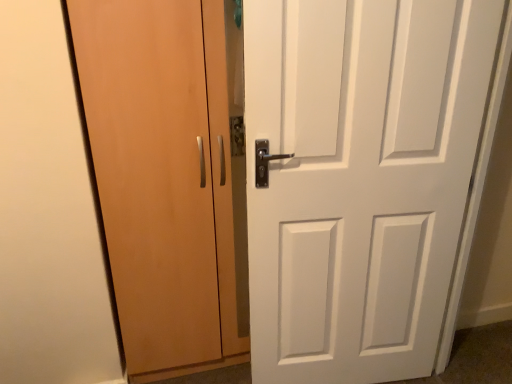
I want to click on matte wood cabinet at left, marked as the 1th door in a left-to-right arrangement, so click(162, 177).

Image resolution: width=512 pixels, height=384 pixels. What do you see at coordinates (162, 177) in the screenshot? I see `matte wood cabinet at left, marked as the 1th door in a left-to-right arrangement` at bounding box center [162, 177].

This screenshot has width=512, height=384. Find the location of `white matte door at center, which is counted as the first door, starting from the right`. white matte door at center, which is counted as the first door, starting from the right is located at coordinates (358, 178).

This screenshot has height=384, width=512. What do you see at coordinates (358, 178) in the screenshot? I see `white matte door at center, the 2th door when ordered from left to right` at bounding box center [358, 178].

The height and width of the screenshot is (384, 512). I want to click on matte wood cabinet at left, marked as the 1th door in a left-to-right arrangement, so click(162, 177).

Can you confirm if matte wood cabinet at left, marked as the 2th door in a right-to-left arrangement, is positioned to the right of white matte door at center, the 2th door when ordered from left to right?

No, matte wood cabinet at left, marked as the 2th door in a right-to-left arrangement, is not to the right of white matte door at center, the 2th door when ordered from left to right.

Based on the photo, is the depth of matte wood cabinet at left, marked as the 2th door in a right-to-left arrangement, greater than that of white matte door at center, the 2th door when ordered from left to right?

Yes, matte wood cabinet at left, marked as the 2th door in a right-to-left arrangement, is behind white matte door at center, the 2th door when ordered from left to right.

Considering the points (217, 75) and (253, 54), which point is behind, point (217, 75) or point (253, 54)?

Positioned behind is point (217, 75).

From the image's perspective, which is above, matte wood cabinet at left, marked as the 1th door in a left-to-right arrangement, or white matte door at center, the 2th door when ordered from left to right?

matte wood cabinet at left, marked as the 1th door in a left-to-right arrangement, appears higher in the image.

From the picture: From a real-world perspective, is matte wood cabinet at left, marked as the 1th door in a left-to-right arrangement, positioned above or below white matte door at center, the 2th door when ordered from left to right?

Clearly, from a real-world perspective, matte wood cabinet at left, marked as the 1th door in a left-to-right arrangement, is above white matte door at center, the 2th door when ordered from left to right.

Looking at their sizes, would you say matte wood cabinet at left, marked as the 1th door in a left-to-right arrangement, is wider or thinner than white matte door at center, which is counted as the first door, starting from the right?

Clearly, matte wood cabinet at left, marked as the 1th door in a left-to-right arrangement, has more width compared to white matte door at center, which is counted as the first door, starting from the right.

From the picture: Between matte wood cabinet at left, marked as the 2th door in a right-to-left arrangement, and white matte door at center, the 2th door when ordered from left to right, which one has more height?

matte wood cabinet at left, marked as the 2th door in a right-to-left arrangement.

Looking at the image, does matte wood cabinet at left, marked as the 2th door in a right-to-left arrangement, seem bigger or smaller compared to white matte door at center, which is counted as the first door, starting from the right?

matte wood cabinet at left, marked as the 2th door in a right-to-left arrangement, is bigger than white matte door at center, which is counted as the first door, starting from the right.

Is white matte door at center, the 2th door when ordered from left to right, located within matte wood cabinet at left, marked as the 1th door in a left-to-right arrangement?

No, white matte door at center, the 2th door when ordered from left to right, is not a part of matte wood cabinet at left, marked as the 1th door in a left-to-right arrangement.

Would you consider matte wood cabinet at left, marked as the 2th door in a right-to-left arrangement, to be distant from white matte door at center, which is counted as the first door, starting from the right?

They are positioned close to each other.

Is matte wood cabinet at left, marked as the 1th door in a left-to-right arrangement, positioned with its back to white matte door at center, the 2th door when ordered from left to right?

That's not correct — matte wood cabinet at left, marked as the 1th door in a left-to-right arrangement, is not looking away from white matte door at center, the 2th door when ordered from left to right.

This screenshot has width=512, height=384. I want to click on door on the left of white matte door at center, which is counted as the first door, starting from the right, so click(x=162, y=177).

Which is more to the left, white matte door at center, the 2th door when ordered from left to right, or matte wood cabinet at left, marked as the 1th door in a left-to-right arrangement?

matte wood cabinet at left, marked as the 1th door in a left-to-right arrangement.

Is the position of white matte door at center, which is counted as the first door, starting from the right, more distant than that of matte wood cabinet at left, marked as the 2th door in a right-to-left arrangement?

No, white matte door at center, which is counted as the first door, starting from the right, is in front of matte wood cabinet at left, marked as the 2th door in a right-to-left arrangement.

Is point (451, 164) more distant than point (194, 143)?

No, it is in front of (194, 143).

From the image's perspective, who appears lower, white matte door at center, which is counted as the first door, starting from the right, or matte wood cabinet at left, marked as the 1th door in a left-to-right arrangement?

From the image's view, white matte door at center, which is counted as the first door, starting from the right, is below.

From a real-world perspective, is white matte door at center, the 2th door when ordered from left to right, positioned above or below matte wood cabinet at left, marked as the 1th door in a left-to-right arrangement?

Clearly, from a real-world perspective, white matte door at center, the 2th door when ordered from left to right, is below matte wood cabinet at left, marked as the 1th door in a left-to-right arrangement.

From the picture: Which of these two, white matte door at center, the 2th door when ordered from left to right, or matte wood cabinet at left, marked as the 2th door in a right-to-left arrangement, is wider?

With larger width is matte wood cabinet at left, marked as the 2th door in a right-to-left arrangement.

Considering the sizes of white matte door at center, which is counted as the first door, starting from the right, and matte wood cabinet at left, marked as the 2th door in a right-to-left arrangement, in the image, is white matte door at center, which is counted as the first door, starting from the right, taller or shorter than matte wood cabinet at left, marked as the 2th door in a right-to-left arrangement,?

In the image, white matte door at center, which is counted as the first door, starting from the right, appears to be shorter than matte wood cabinet at left, marked as the 2th door in a right-to-left arrangement.

In the scene shown: Is white matte door at center, the 2th door when ordered from left to right, bigger or smaller than matte wood cabinet at left, marked as the 1th door in a left-to-right arrangement?

Clearly, white matte door at center, the 2th door when ordered from left to right, is smaller in size than matte wood cabinet at left, marked as the 1th door in a left-to-right arrangement.

Is white matte door at center, the 2th door when ordered from left to right, completely or partially outside of matte wood cabinet at left, marked as the 2th door in a right-to-left arrangement?

Absolutely, white matte door at center, the 2th door when ordered from left to right, is external to matte wood cabinet at left, marked as the 2th door in a right-to-left arrangement.

Is white matte door at center, the 2th door when ordered from left to right, placed right next to matte wood cabinet at left, marked as the 2th door in a right-to-left arrangement?

No, white matte door at center, the 2th door when ordered from left to right, is not making contact with matte wood cabinet at left, marked as the 2th door in a right-to-left arrangement.

Could you tell me if white matte door at center, which is counted as the first door, starting from the right, is facing matte wood cabinet at left, marked as the 2th door in a right-to-left arrangement?

No, white matte door at center, which is counted as the first door, starting from the right, is not oriented towards matte wood cabinet at left, marked as the 2th door in a right-to-left arrangement.

What are the coordinates of `door on the left of white matte door at center, the 2th door when ordered from left to right` in the screenshot? It's located at (162, 177).

Locate an element on the screen. The image size is (512, 384). door above the white matte door at center, the 2th door when ordered from left to right (from a real-world perspective) is located at coordinates (162, 177).

Where is `door located on the right of matte wood cabinet at left, marked as the 2th door in a right-to-left arrangement`? This screenshot has height=384, width=512. door located on the right of matte wood cabinet at left, marked as the 2th door in a right-to-left arrangement is located at coordinates (358, 178).